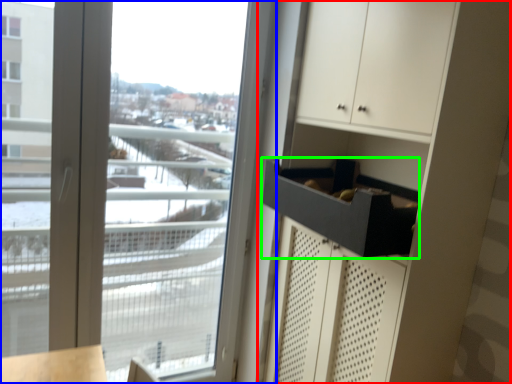
Question: Based on their relative distances, which object is nearer to dresser (highlighted by a red box)? Choose from window (highlighted by a blue box) and drawer (highlighted by a green box).

Choices:
 (A) window
 (B) drawer

Answer: (B)